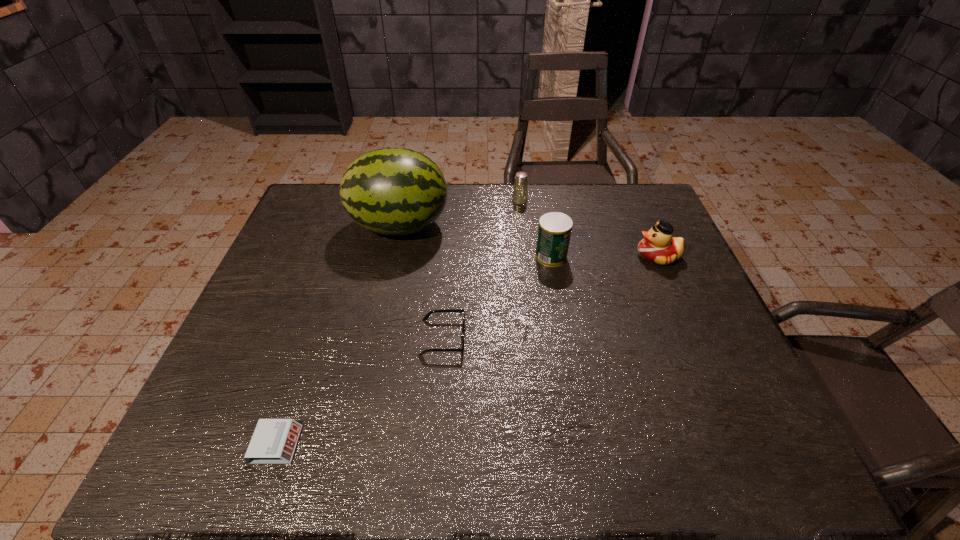
Locate an element on the screen. Image resolution: width=960 pixels, height=540 pixels. object situated at the right edge is located at coordinates (659, 246).

Image resolution: width=960 pixels, height=540 pixels. Find the location of `object positioned at the near left corner`. object positioned at the near left corner is located at coordinates (274, 441).

In the image, there is a desktop. Where is `free space at the far edge`? free space at the far edge is located at coordinates click(x=500, y=187).

Locate an element on the screen. This screenshot has width=960, height=540. blank space at the near edge of the desktop is located at coordinates [x=509, y=468].

Locate an element on the screen. This screenshot has width=960, height=540. free location at the left edge is located at coordinates pos(241,373).

Find the location of a particular element. free space at the right edge of the desktop is located at coordinates pos(681,314).

In the image, there is a desktop. Where is `free space at the far left corner`? The width and height of the screenshot is (960, 540). free space at the far left corner is located at coordinates (316, 191).

Locate an element on the screen. The width and height of the screenshot is (960, 540). free space between the watermelon and the rightmost object is located at coordinates (529, 241).

At what (x,y) coordinates should I click in order to perform the action: click on free area in between the tallest object and the nearest object. Please return your answer as a coordinate pair (x, y). Looking at the image, I should click on (338, 335).

Where is `vacant area between the sunglasses and the saltshaker`? The width and height of the screenshot is (960, 540). vacant area between the sunglasses and the saltshaker is located at coordinates (481, 269).